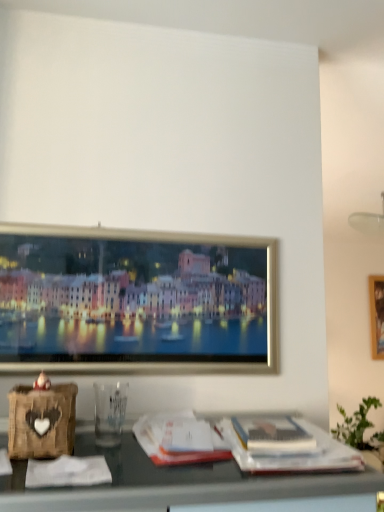
Question: Is white paper magazine at center, which is counted as the second magazine, starting from the right, taller or shorter than matte white magazine at lower right, the first magazine viewed from the right?

Choices:
 (A) short
 (B) tall

Answer: (B)

Question: From a real-world perspective, is white paper magazine at center, the first magazine viewed from the left, positioned above or below matte white magazine at lower right, which is the 2th magazine in left-to-right order?

Choices:
 (A) above
 (B) below

Answer: (B)

Question: Is white paper magazine at center, the first magazine viewed from the left, to the left or to the right of matte white magazine at lower right, the first magazine viewed from the right, in the image?

Choices:
 (A) right
 (B) left

Answer: (B)

Question: Relative to white paper magazine at center, which is counted as the second magazine, starting from the right, is matte white magazine at lower right, the first magazine viewed from the right, in front or behind?

Choices:
 (A) front
 (B) behind

Answer: (B)

Question: In terms of size, does matte white magazine at lower right, which is the 2th magazine in left-to-right order, appear bigger or smaller than white paper magazine at center, the first magazine viewed from the left?

Choices:
 (A) small
 (B) big

Answer: (A)

Question: Considering the positions of matte white magazine at lower right, the first magazine viewed from the right, and white paper magazine at center, which is counted as the second magazine, starting from the right, in the image, is matte white magazine at lower right, the first magazine viewed from the right, taller or shorter than white paper magazine at center, which is counted as the second magazine, starting from the right,?

Choices:
 (A) short
 (B) tall

Answer: (A)

Question: Considering the relative positions of matte white magazine at lower right, the first magazine viewed from the right, and white paper magazine at center, the first magazine viewed from the left, in the image provided, is matte white magazine at lower right, the first magazine viewed from the right, to the left or to the right of white paper magazine at center, the first magazine viewed from the left,?

Choices:
 (A) right
 (B) left

Answer: (A)